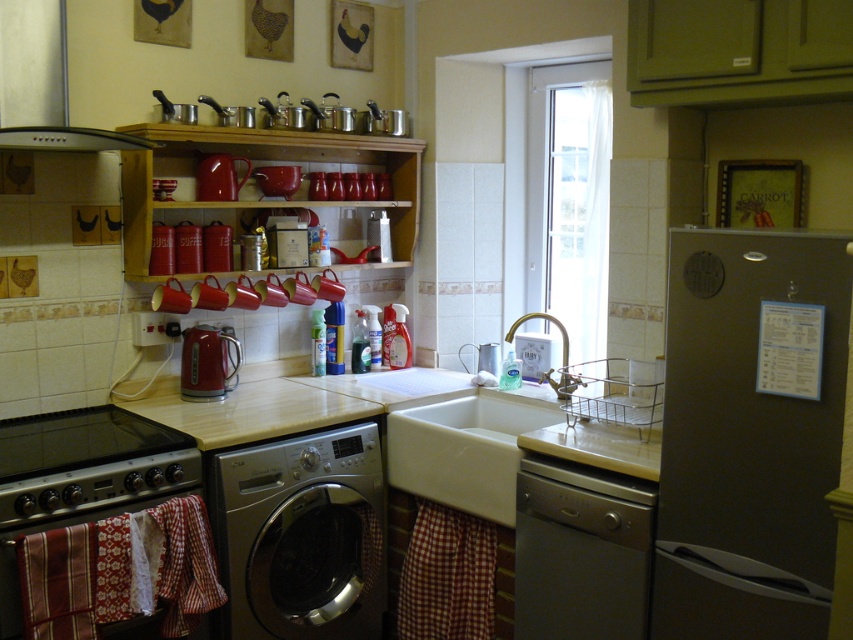
Question: Which of the following is the closest to the observer?

Choices:
 (A) (239, 632)
 (B) (126, 216)

Answer: (A)

Question: Does silver metallic washing machine at lower center appear on the right side of wooden shelves at upper center?

Choices:
 (A) yes
 (B) no

Answer: (A)

Question: Which of these objects is positioned farthest from the red and white checkered towels at lower left?

Choices:
 (A) silver metallic washing machine at lower center
 (B) satin silver dishwasher at lower center

Answer: (B)

Question: Which of the following is the farthest from the observer?

Choices:
 (A) red checkered fabric at lower center
 (B) white ceramic sink at center

Answer: (A)

Question: From the image, what is the correct spatial relationship of white ceramic sink at center in relation to shiny metallic kettle at center-left?

Choices:
 (A) below
 (B) above

Answer: (A)

Question: Can you confirm if white ceramic sink at center is positioned to the left of red checkered fabric at lower center?

Choices:
 (A) yes
 (B) no

Answer: (B)